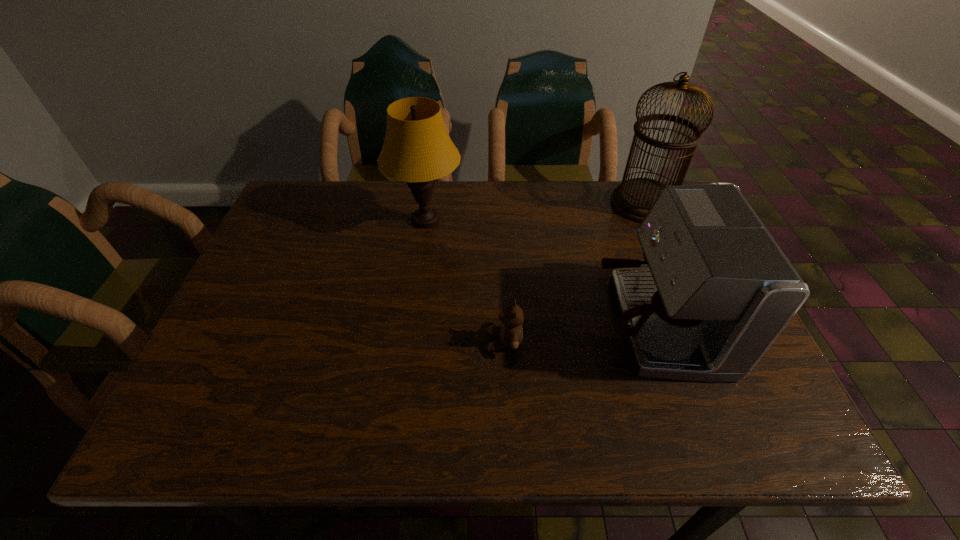
This screenshot has height=540, width=960. Find the location of `object identified as the closest to the coffee maker`. object identified as the closest to the coffee maker is located at coordinates (510, 333).

Point out which object is positioned as the second nearest to the third object from right to left. Please provide its 2D coordinates. Your answer should be formatted as a tuple, i.e. [(x, y)], where the tuple contains the x and y coordinates of a point satisfying the conditions above.

[(417, 149)]

Find the location of a particular element. free location that satisfies the following two spatial constraints: 1. on the front-facing side of the birdcage; 2. on the front side of the lampshade is located at coordinates (652, 220).

At what (x,y) coordinates should I click in order to perform the action: click on free space that satisfies the following two spatial constraints: 1. on the front-facing side of the birdcage; 2. on the front side of the lampshade. Please return your answer as a coordinate pair (x, y). Looking at the image, I should click on (652, 220).